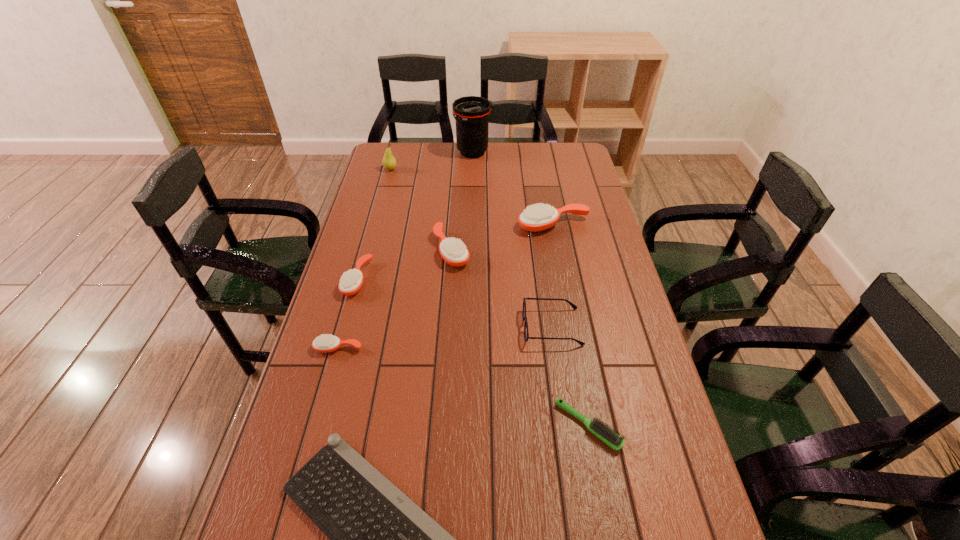
The width and height of the screenshot is (960, 540). What are the coordinates of `the farthest object` in the screenshot? It's located at (472, 113).

Locate an element on the screen. the tallest object is located at coordinates (472, 113).

The image size is (960, 540). In order to click on the second tallest object in this screenshot , I will do 389,162.

Locate an element on the screen. pear is located at coordinates (389, 162).

The image size is (960, 540). I want to click on the tallest hairbrush, so click(538, 217).

In order to click on the rightmost orange hairbrush in this screenshot , I will do `click(538, 217)`.

Find the location of a particular element. the fourth shortest hairbrush is located at coordinates (454, 252).

Where is `the third orange hairbrush from left to right`? the third orange hairbrush from left to right is located at coordinates (454, 252).

Locate an element on the screen. This screenshot has width=960, height=540. spectacles is located at coordinates (526, 333).

Where is `the third tallest hairbrush`? This screenshot has height=540, width=960. the third tallest hairbrush is located at coordinates (351, 281).